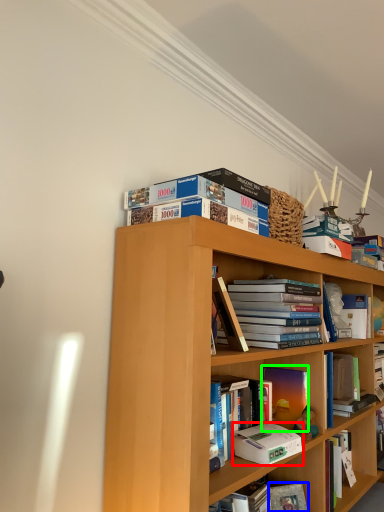
Question: Considering the real-world distances, which object is closest to paperback book (highlighted by a red box)? paperback book (highlighted by a blue box) or book (highlighted by a green box).

Choices:
 (A) paperback book
 (B) book

Answer: (B)